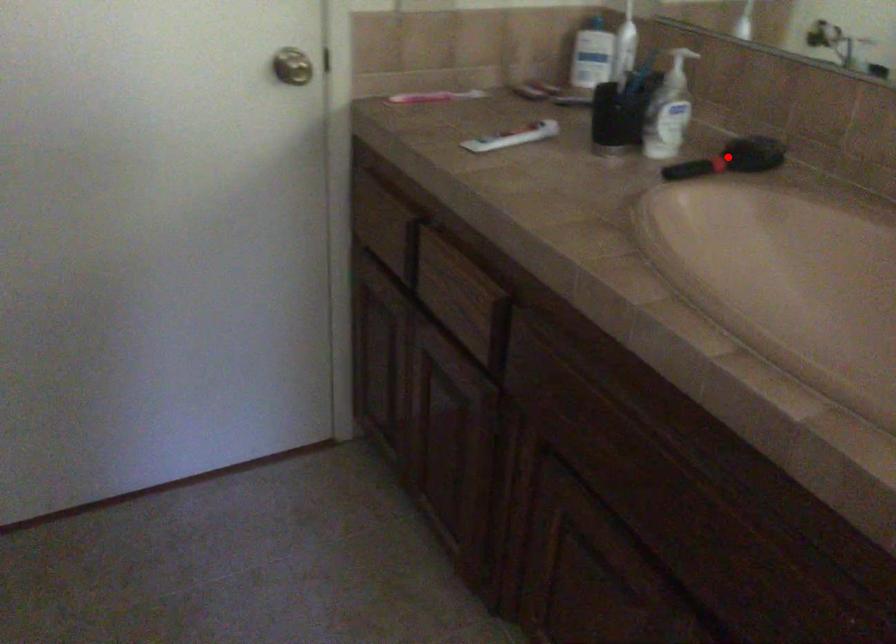
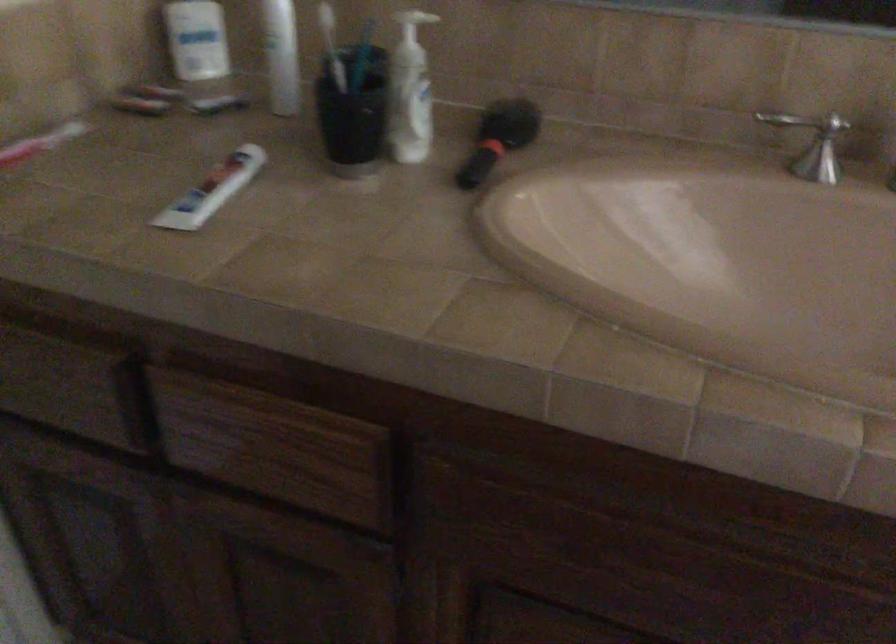
Question: I am providing you with two images of the same scene from different viewpoints. Image1 has a red point marked. In image2, the corresponding 3D location appears at what relative position? Reply with the corresponding letter.

Choices:
 (A) Closer
 (B) Farther

Answer: (A)